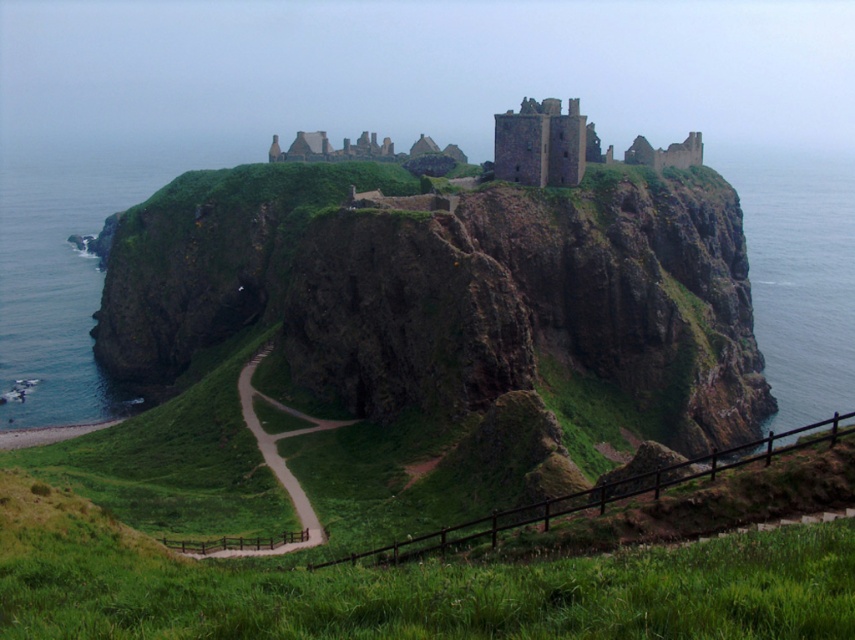
Question: Which point is closer to the camera taking this photo?

Choices:
 (A) (756, 300)
 (B) (502, 157)
 (C) (242, 369)

Answer: (C)

Question: Does greenish-blue water at lower left appear under dirt/gravel path at center?

Choices:
 (A) yes
 (B) no

Answer: (B)

Question: Is clear blue water at cliff edge above brown stone ruins at upper center?

Choices:
 (A) no
 (B) yes

Answer: (B)

Question: Does greenish-blue water at lower left have a smaller size compared to brown stone ruins at upper center?

Choices:
 (A) no
 (B) yes

Answer: (A)

Question: Which is nearer to the greenish-blue water at lower left?

Choices:
 (A) dirt/gravel path at center
 (B) clear blue water at cliff edge
 (C) brown stone ruins at upper center

Answer: (C)

Question: Which is nearer to the greenish-blue water at lower left?

Choices:
 (A) clear blue water at cliff edge
 (B) dirt/gravel path at center
 (C) brown stone ruins at upper center

Answer: (C)